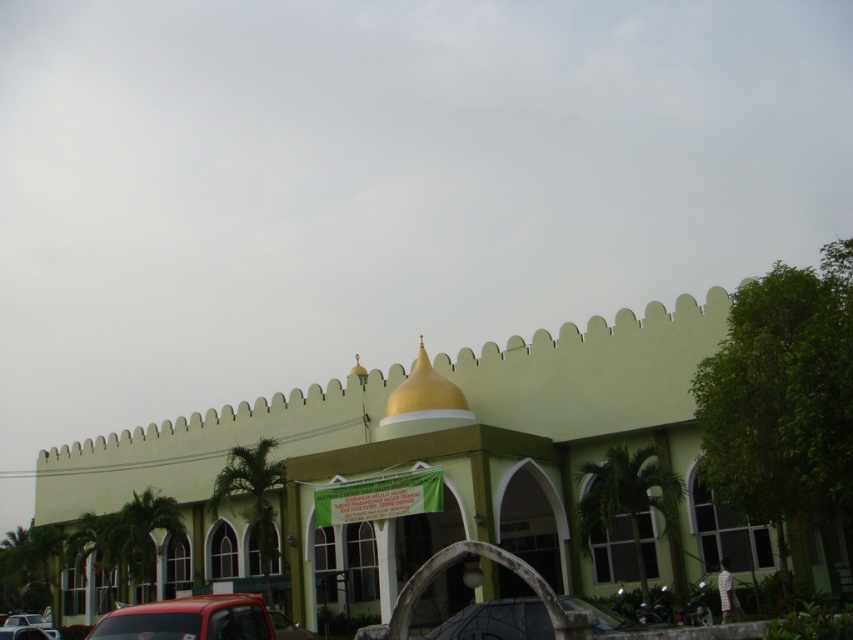
You are standing at the entrance of the mosque and want to park your metallic silver car at lower center. The parking spot is located at point (496, 621). Can you safely drive your car to that spot without hitting the golden dome?

The metallic silver car at lower center is located at point (496, 621), which is at the lower center of the scene. The golden dome is situated towards the center of the building. Since the car is at lower center and the dome is on the building itself, there is no risk of collision when parking at that spot.

You are standing in front of the mosque and want to take a photo of both the green matte building at center and the metallic red truck at lower left. Which object should you focus on first to ensure both are in the frame?

You should focus on the green matte building at center first since it is closer to you than the metallic red truck at lower left, ensuring both remain in the frame.